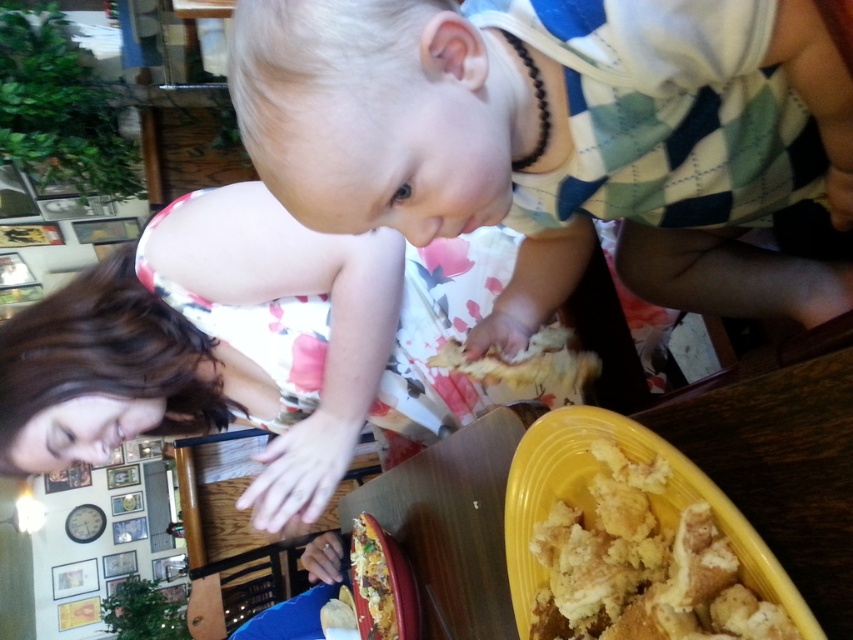
You are a chef preparing a meal and need to choose between the golden crumbly bread at lower right and the golden crumbly bread at center for a dish that requires a larger portion. Which one should you choose?

The golden crumbly bread at center is the better choice because it occupies more space than the golden crumbly bread at lower right, providing a larger portion for the dish.

You are a photographer trying to capture the child reaching for the food. You want to focus on the point that is closer to the camera. Which point should you choose between point (657, 524) and point (384, 609)?

Point (657, 524) is closer to the camera than point (384, 609), so you should choose point (657, 524) to focus on.